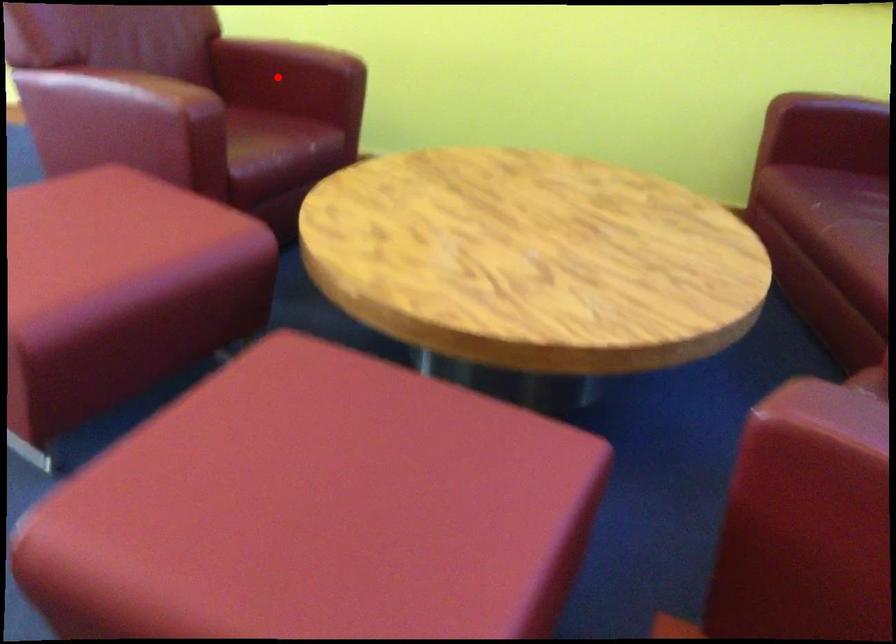
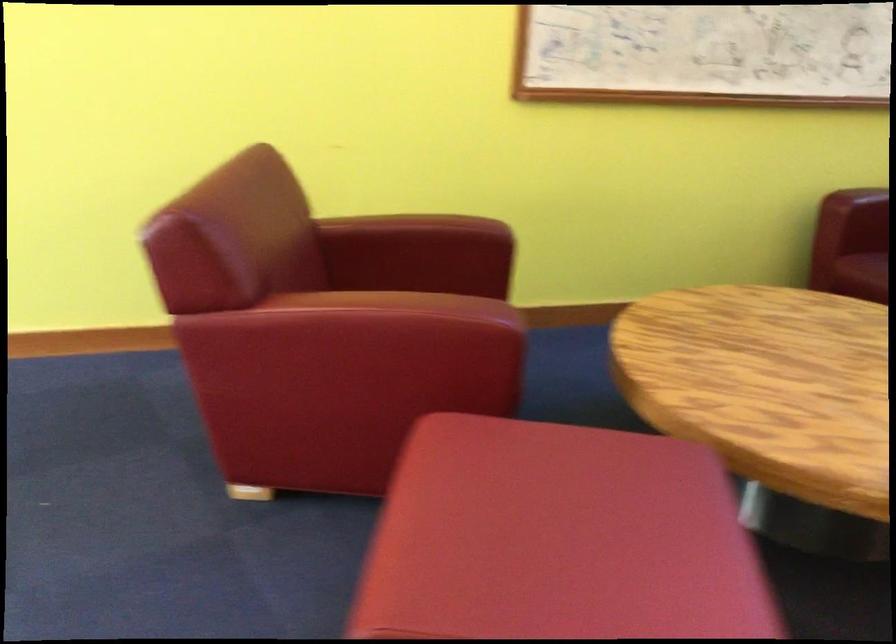
Question: A red point is marked in image1. In image2, is the corresponding 3D point closer to the camera or farther? Reply with the corresponding letter.

Choices:
 (A) The corresponding 3D point is closer.
 (B) The corresponding 3D point is farther.

Answer: (A)